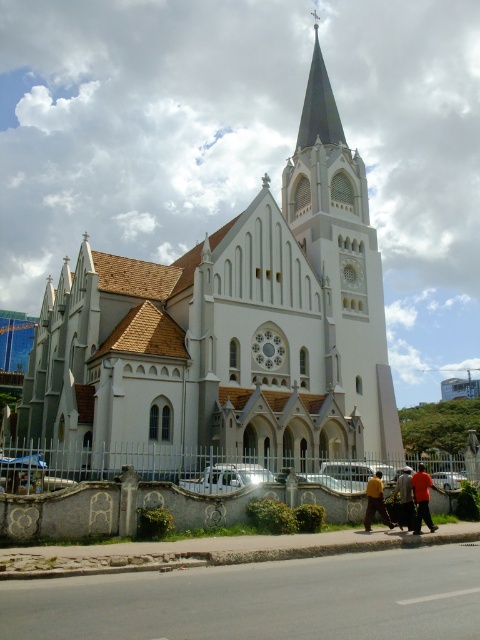
Question: Is white stone church at center below red fabric pants at center?

Choices:
 (A) no
 (B) yes

Answer: (A)

Question: Is red fabric pants at center further to the viewer compared to dark brown leather jacket at center?

Choices:
 (A) yes
 (B) no

Answer: (B)

Question: Which point is farther to the camera?

Choices:
 (A) yellow fabric pants at lower center
 (B) white stone church at center
 (C) smooth gray steeple at upper center
 (D) dark brown leather jacket at center

Answer: (C)

Question: Which of the following is the farthest from the observer?

Choices:
 (A) dark brown leather jacket at center
 (B) smooth gray steeple at upper center
 (C) white stone church at center
 (D) red fabric pants at center

Answer: (B)

Question: Which object appears farthest from the camera in this image?

Choices:
 (A) dark brown leather jacket at center
 (B) white stone church at center

Answer: (B)

Question: Is smooth gray steeple at upper center below yellow fabric pants at lower center?

Choices:
 (A) no
 (B) yes

Answer: (A)